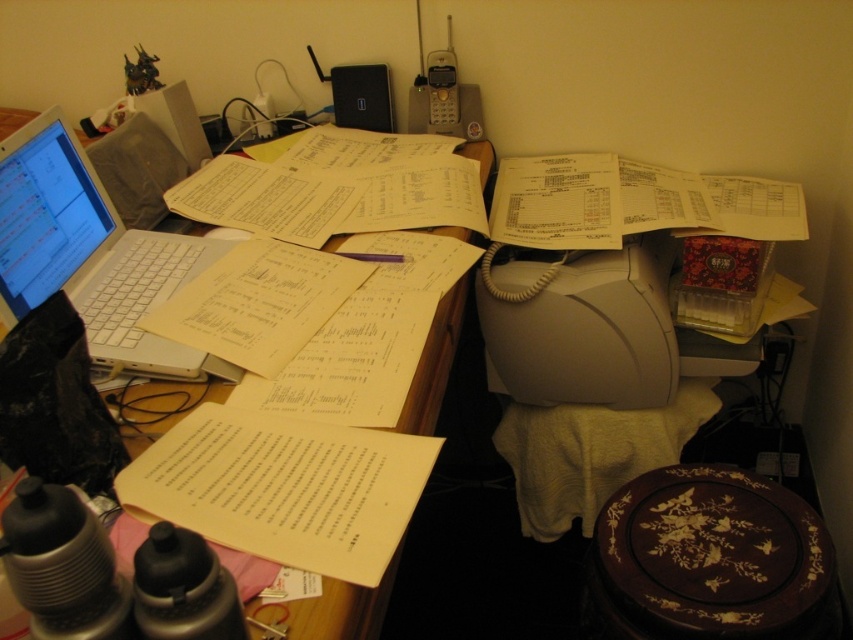
Question: Considering the real-world distances, which object is farthest from the white matte laptop at left?

Choices:
 (A) yellow paper at center
 (B) wooden at left

Answer: (A)

Question: Which object is farther from the camera taking this photo?

Choices:
 (A) white matte laptop at left
 (B) yellow paper at center
 (C) wooden plate with inlaid design at lower right
 (D) wooden at left

Answer: (C)

Question: Is white matte laptop at left below wooden at left?

Choices:
 (A) no
 (B) yes

Answer: (A)

Question: Among these objects, which one is farthest from the camera?

Choices:
 (A) yellow paper at center
 (B) wooden plate with inlaid design at lower right
 (C) wooden at left
 (D) white matte laptop at left

Answer: (B)

Question: Can you confirm if wooden plate with inlaid design at lower right is positioned to the right of white matte laptop at left?

Choices:
 (A) yes
 (B) no

Answer: (A)

Question: Does wooden plate with inlaid design at lower right appear on the left side of yellow paper at center?

Choices:
 (A) no
 (B) yes

Answer: (A)